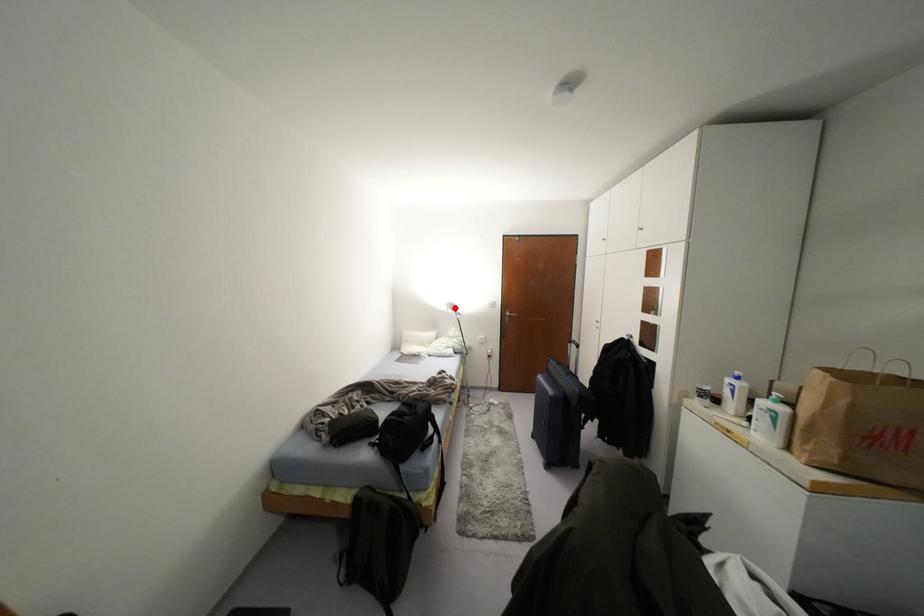
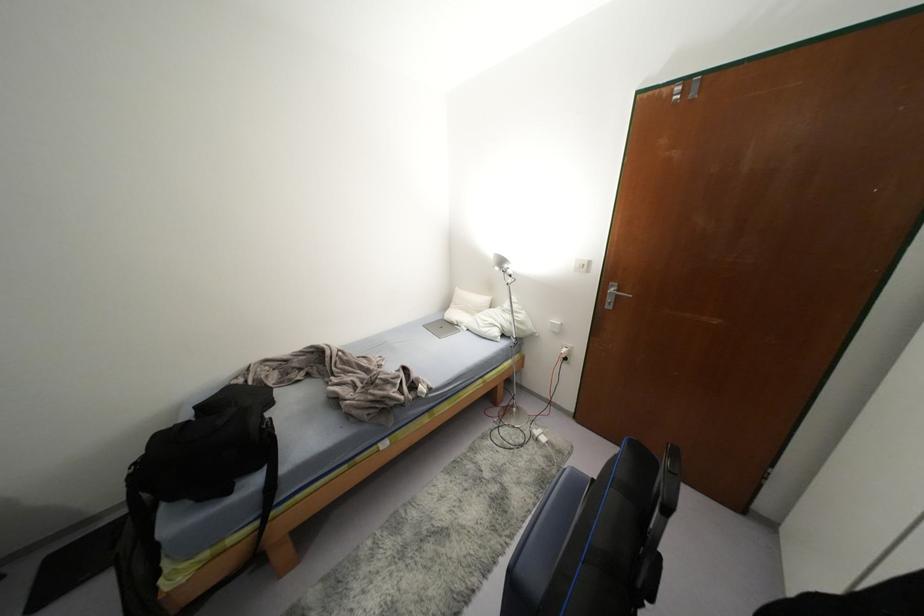
Locate, in the second image, the point that corresponds to the highlighted location in the first image.

(505, 265)